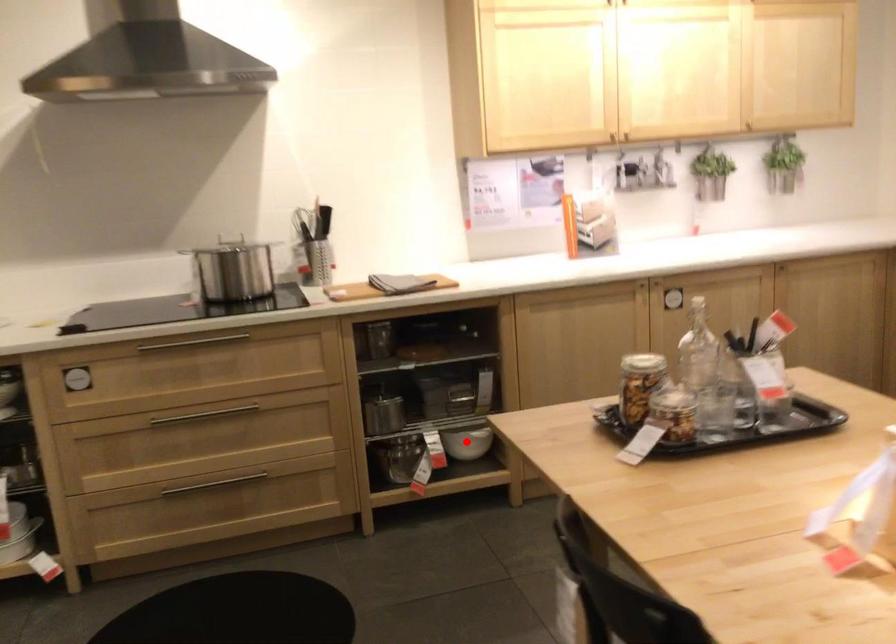
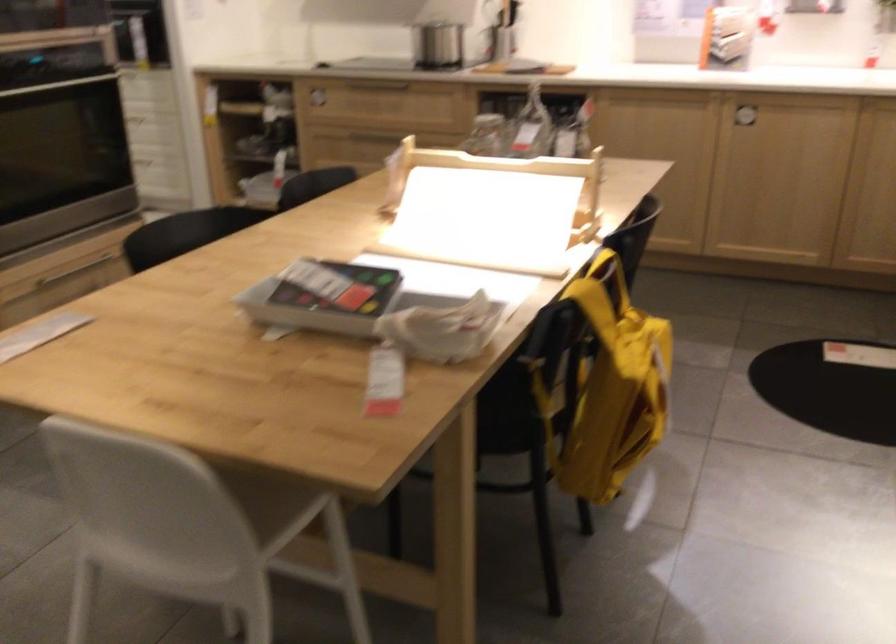
Question: I am providing you with two images of the same scene from different viewpoints. A red point is marked on the first image. Is the red point's position out of view in image 2?

Choices:
 (A) Yes
 (B) No

Answer: (A)